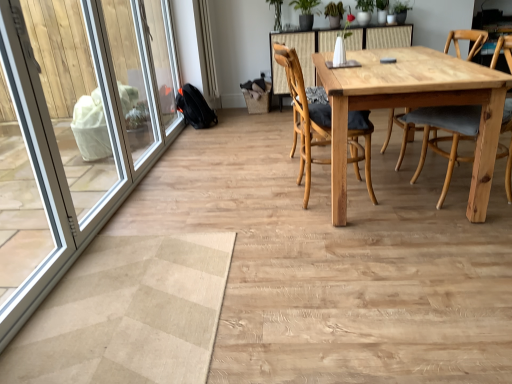
Question: From the image's perspective, is white plastic screen door at left located beneath natural wood table at center?

Choices:
 (A) yes
 (B) no

Answer: (A)

Question: Does white plastic screen door at left have a lesser height compared to natural wood table at center?

Choices:
 (A) no
 (B) yes

Answer: (A)

Question: From a real-world perspective, is white plastic screen door at left on natural wood table at center?

Choices:
 (A) yes
 (B) no

Answer: (A)

Question: Does white plastic screen door at left contain natural wood table at center?

Choices:
 (A) yes
 (B) no

Answer: (B)

Question: Considering the relative positions of white plastic screen door at left and natural wood table at center in the image provided, is white plastic screen door at left in front of natural wood table at center?

Choices:
 (A) yes
 (B) no

Answer: (A)

Question: Considering the relative sizes of white plastic screen door at left and natural wood table at center in the image provided, is white plastic screen door at left taller than natural wood table at center?

Choices:
 (A) no
 (B) yes

Answer: (B)

Question: Can you confirm if natural wood table at center is positioned to the right of light brown wood chair at center, acting as the first chair starting from the right?

Choices:
 (A) yes
 (B) no

Answer: (B)

Question: Can light brown wood chair at center, the second chair when ordered from left to right, be found inside natural wood table at center?

Choices:
 (A) no
 (B) yes

Answer: (B)

Question: Considering the relative sizes of natural wood table at center and light brown wood chair at center, acting as the first chair starting from the right, in the image provided, is natural wood table at center smaller than light brown wood chair at center, acting as the first chair starting from the right,?

Choices:
 (A) yes
 (B) no

Answer: (B)

Question: From the image's perspective, is natural wood table at center beneath light brown wood chair at center, the second chair when ordered from left to right?

Choices:
 (A) no
 (B) yes

Answer: (A)

Question: Does natural wood table at center have a lesser height compared to light brown wood chair at center, acting as the first chair starting from the right?

Choices:
 (A) yes
 (B) no

Answer: (A)

Question: From a real-world perspective, is natural wood table at center positioned under light brown wood chair at center, the second chair when ordered from left to right, based on gravity?

Choices:
 (A) yes
 (B) no

Answer: (A)

Question: From a real-world perspective, is wooden chair at center, which is the first chair from left to right, on top of green leafy plant at upper center?

Choices:
 (A) no
 (B) yes

Answer: (A)